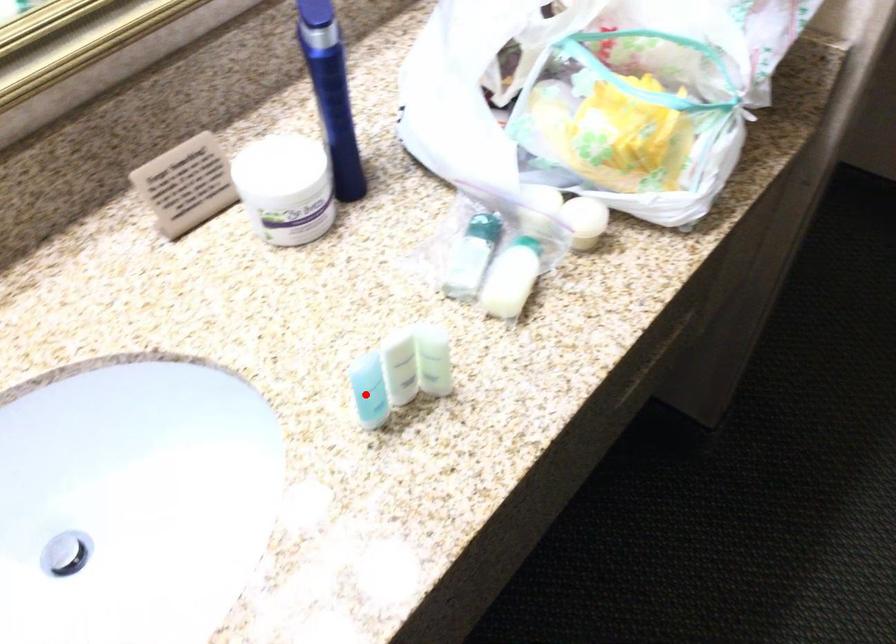
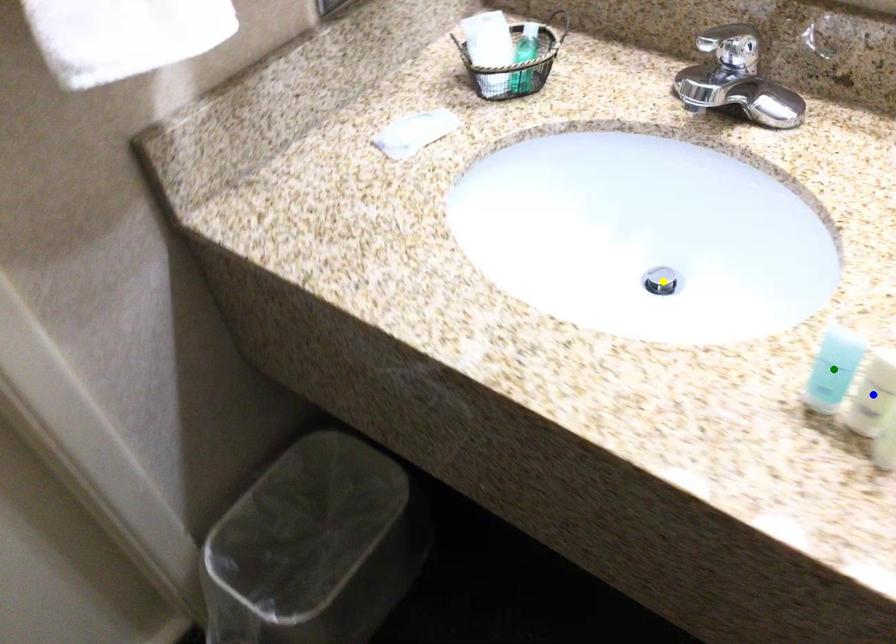
Question: I am providing you with two images of the same scene from different viewpoints. A red point is marked on the first image. You are given multiple points on the second image. Which point in image 2 represents the same 3d spot as the red point in image 1?

Choices:
 (A) green point
 (B) yellow point
 (C) blue point

Answer: (A)